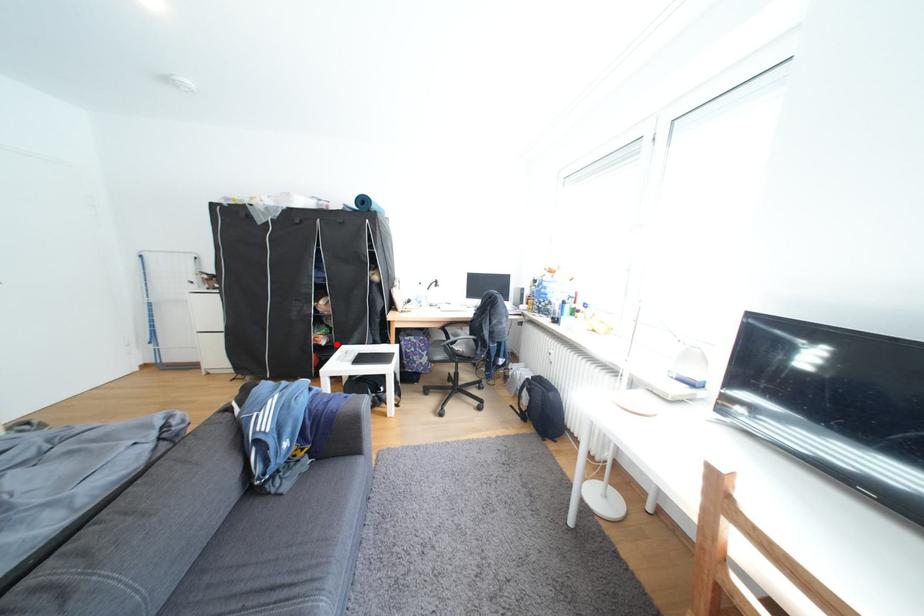
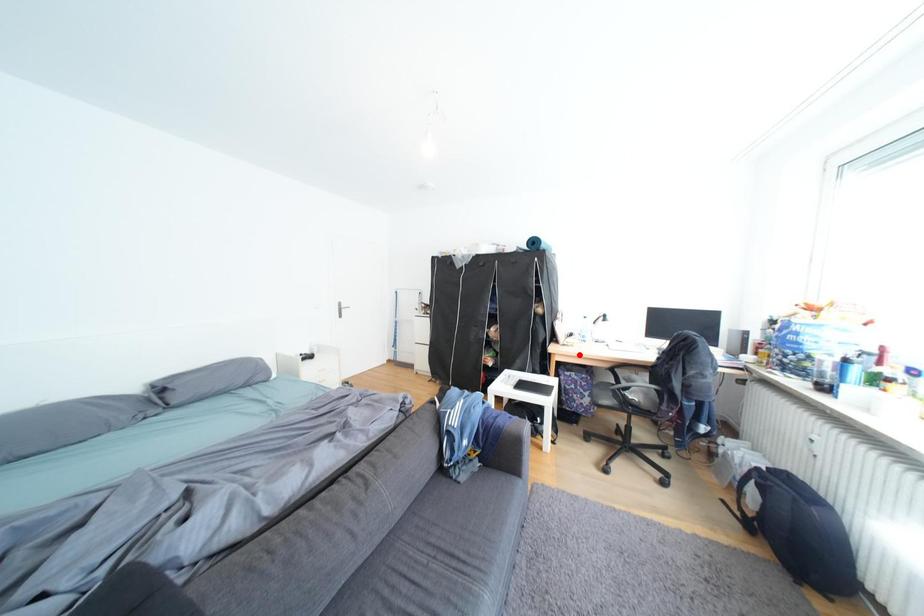
I am providing you with two images of the same scene from different viewpoints. A red point is marked on the first image and another point is marked on the second image. Do the highlighted points in image1 and image2 indicate the same real-world spot?

No